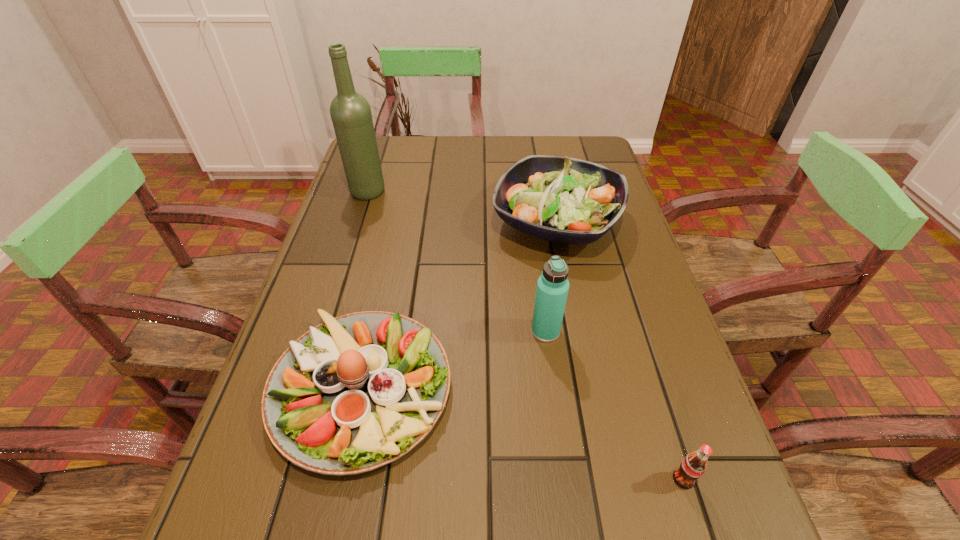
The height and width of the screenshot is (540, 960). In the image, there is a desktop. In order to click on vacant space at the far right corner in this screenshot , I will do (x=559, y=146).

The width and height of the screenshot is (960, 540). What are the coordinates of `vacant area that lies between the soda and the wine bottle` in the screenshot? It's located at (525, 336).

The image size is (960, 540). Find the location of `free space that is in between the farther salad plate and the soda`. free space that is in between the farther salad plate and the soda is located at coordinates (620, 350).

Identify the location of free space between the shorter salad plate and the thermos bottle. (454, 360).

Where is `free area in between the soda and the farther salad plate`? The height and width of the screenshot is (540, 960). free area in between the soda and the farther salad plate is located at coordinates (620, 350).

You are a GUI agent. You are given a task and a screenshot of the screen. Output one action in this format:
    pyautogui.click(x=<x>, y=<y>)
    Task: Click on the free area in between the shorter salad plate and the soda
    The height and width of the screenshot is (540, 960).
    Given the screenshot: What is the action you would take?
    pyautogui.click(x=522, y=434)

The image size is (960, 540). In order to click on vacant area that lies between the third shortest object and the wine bottle in this screenshot , I will do `click(462, 207)`.

Find the location of `free space that is in between the soda and the left salad plate`. free space that is in between the soda and the left salad plate is located at coordinates (522, 434).

Identify the location of free space between the right salad plate and the soda. This screenshot has height=540, width=960. (620, 350).

Locate an element on the screen. The height and width of the screenshot is (540, 960). free spot between the left salad plate and the right salad plate is located at coordinates (459, 305).